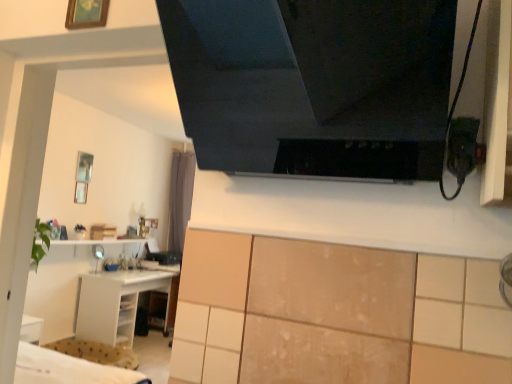
This screenshot has height=384, width=512. What do you see at coordinates (313, 83) in the screenshot?
I see `black glossy exhaust hood at upper center` at bounding box center [313, 83].

What do you see at coordinates (86, 14) in the screenshot? I see `wooden picture frame at upper left, acting as the 1th picture frame starting from the front` at bounding box center [86, 14].

Image resolution: width=512 pixels, height=384 pixels. I want to click on wooden picture frame at upper left, the 2th picture frame in the left-to-right sequence, so click(x=86, y=14).

Locate an element on the screen. This screenshot has width=512, height=384. metallic silver picture frame at upper left, positioned as the 2th picture frame in top-to-bottom order is located at coordinates click(x=81, y=192).

Describe the element at coordinates (180, 197) in the screenshot. The height and width of the screenshot is (384, 512). I see `gray fabric curtain at center` at that location.

The height and width of the screenshot is (384, 512). I want to click on black glossy exhaust hood at upper center, so click(x=313, y=83).

Is metallic silver picture frame at upper left, placed as the first picture frame when sorted from left to right, wider or thinner than black glossy exhaust hood at upper center?

Clearly, metallic silver picture frame at upper left, placed as the first picture frame when sorted from left to right, has less width compared to black glossy exhaust hood at upper center.

What's the angular difference between metallic silver picture frame at upper left, the 2th picture frame positioned from the right, and black glossy exhaust hood at upper center's facing directions?

89.5 degrees separate the facing orientations of metallic silver picture frame at upper left, the 2th picture frame positioned from the right, and black glossy exhaust hood at upper center.

Based on the photo, is metallic silver picture frame at upper left, the 2th picture frame positioned from the right, turned away from black glossy exhaust hood at upper center?

metallic silver picture frame at upper left, the 2th picture frame positioned from the right, is not turned away from black glossy exhaust hood at upper center.

Does black glossy exhaust hood at upper center touch white glossy shelf at lower left?

black glossy exhaust hood at upper center and white glossy shelf at lower left are not in contact.

Who is smaller, black glossy exhaust hood at upper center or white glossy shelf at lower left?

With smaller size is black glossy exhaust hood at upper center.

Which object is further away from the camera taking this photo, black glossy exhaust hood at upper center or white glossy shelf at lower left?

white glossy shelf at lower left is further from the camera.

What's the angular difference between black glossy exhaust hood at upper center and white glossy shelf at lower left's facing directions?

The facing directions of black glossy exhaust hood at upper center and white glossy shelf at lower left are 90.9 degrees apart.

What's the angular difference between wooden picture frame at upper left, acting as the 1th picture frame starting from the front, and gray fabric curtain at center's facing directions?

The facing directions of wooden picture frame at upper left, acting as the 1th picture frame starting from the front, and gray fabric curtain at center are 0.00233 degrees apart.

From the image's perspective, is wooden picture frame at upper left, the 1th picture frame viewed from the top, above gray fabric curtain at center?

Yes.

In terms of size, does wooden picture frame at upper left, which is the 1th picture frame in right-to-left order, appear bigger or smaller than gray fabric curtain at center?

In the image, wooden picture frame at upper left, which is the 1th picture frame in right-to-left order, appears to be smaller than gray fabric curtain at center.

Is wooden picture frame at upper left, which is the 1th picture frame in right-to-left order, wider than gray fabric curtain at center?

No, wooden picture frame at upper left, which is the 1th picture frame in right-to-left order, is not wider than gray fabric curtain at center.

Which object is closer to the camera, white glossy shelf at lower left or wooden picture frame at upper left, the 2th picture frame in the left-to-right sequence?

wooden picture frame at upper left, the 2th picture frame in the left-to-right sequence, is more forward.

Considering the sizes of objects white glossy shelf at lower left and wooden picture frame at upper left, the 2th picture frame in the left-to-right sequence, in the image provided, who is thinner, white glossy shelf at lower left or wooden picture frame at upper left, the 2th picture frame in the left-to-right sequence,?

wooden picture frame at upper left, the 2th picture frame in the left-to-right sequence, is thinner.

Between gray fabric curtain at center and black glossy exhaust hood at upper center, which one has larger width?

Wider between the two is black glossy exhaust hood at upper center.

Who is smaller, gray fabric curtain at center or black glossy exhaust hood at upper center?

black glossy exhaust hood at upper center.

What are the coordinates of `curtain below the black glossy exhaust hood at upper center (from the image's perspective)` in the screenshot? It's located at (180, 197).

How different are the orientations of metallic silver picture frame at upper left, which is counted as the 2th picture frame, starting from the front, and wooden picture frame at upper left, the 1th picture frame viewed from the top, in degrees?

The facing directions of metallic silver picture frame at upper left, which is counted as the 2th picture frame, starting from the front, and wooden picture frame at upper left, the 1th picture frame viewed from the top, are 89.3 degrees apart.

In the scene shown: Is wooden picture frame at upper left, acting as the 1th picture frame starting from the front, located within metallic silver picture frame at upper left, positioned as the 2th picture frame in top-to-bottom order?

That's incorrect, wooden picture frame at upper left, acting as the 1th picture frame starting from the front, is not inside metallic silver picture frame at upper left, positioned as the 2th picture frame in top-to-bottom order.

From the image's perspective, between metallic silver picture frame at upper left, positioned as the 2th picture frame in top-to-bottom order, and wooden picture frame at upper left, the 1th picture frame viewed from the top, who is located below?

metallic silver picture frame at upper left, positioned as the 2th picture frame in top-to-bottom order, is shown below in the image.

In terms of size, does metallic silver picture frame at upper left, positioned as the 2th picture frame in top-to-bottom order, appear bigger or smaller than wooden picture frame at upper left, which is the 1th picture frame in right-to-left order?

In the image, metallic silver picture frame at upper left, positioned as the 2th picture frame in top-to-bottom order, appears to be larger than wooden picture frame at upper left, which is the 1th picture frame in right-to-left order.

Is metallic silver picture frame at upper left, the 2th picture frame positioned from the right, wider or thinner than white glossy shelf at lower left?

Considering their sizes, metallic silver picture frame at upper left, the 2th picture frame positioned from the right, looks slimmer than white glossy shelf at lower left.

In order to click on shelf that is below the metallic silver picture frame at upper left, the 2th picture frame positioned from the right (from the image's perspective) in this screenshot , I will do `click(119, 303)`.

Considering the sizes of metallic silver picture frame at upper left, positioned as the 2th picture frame in top-to-bottom order, and white glossy shelf at lower left in the image, is metallic silver picture frame at upper left, positioned as the 2th picture frame in top-to-bottom order, taller or shorter than white glossy shelf at lower left?

In the image, metallic silver picture frame at upper left, positioned as the 2th picture frame in top-to-bottom order, appears to be shorter than white glossy shelf at lower left.

Does metallic silver picture frame at upper left, placed as the first picture frame when sorted from left to right, turn towards white glossy shelf at lower left?

No, metallic silver picture frame at upper left, placed as the first picture frame when sorted from left to right, is not facing towards white glossy shelf at lower left.

Identify the location of exhaust hood above the metallic silver picture frame at upper left, placed as the first picture frame when sorted from left to right (from the image's perspective). This screenshot has width=512, height=384. (313, 83).

Where is `shelf on the left of black glossy exhaust hood at upper center`? The height and width of the screenshot is (384, 512). shelf on the left of black glossy exhaust hood at upper center is located at coordinates (119, 303).

Which object lies nearer to the anchor point wooden picture frame at upper left, acting as the second picture frame starting from the bottom, white glossy shelf at lower left or black glossy exhaust hood at upper center?

black glossy exhaust hood at upper center is positioned closer to the anchor wooden picture frame at upper left, acting as the second picture frame starting from the bottom.

When comparing their distances from black glossy exhaust hood at upper center, does metallic silver picture frame at upper left, which is counted as the first picture frame, starting from the bottom, or white glossy shelf at lower left seem closer?

white glossy shelf at lower left lies closer to black glossy exhaust hood at upper center than the other object.

Estimate the real-world distances between objects in this image. Which object is closer to white glossy shelf at lower left, black glossy exhaust hood at upper center or gray fabric curtain at center?

The object closer to white glossy shelf at lower left is gray fabric curtain at center.

From the picture: Estimate the real-world distances between objects in this image. Which object is further from white glossy shelf at lower left, metallic silver picture frame at upper left, placed as the first picture frame when sorted from left to right, or black glossy exhaust hood at upper center?

The object further to white glossy shelf at lower left is black glossy exhaust hood at upper center.

When comparing their distances from wooden picture frame at upper left, the 2th picture frame in the left-to-right sequence, does white glossy shelf at lower left or gray fabric curtain at center seem further?

gray fabric curtain at center.

When comparing their distances from white glossy shelf at lower left, does gray fabric curtain at center or wooden picture frame at upper left, the 2th picture frame in the left-to-right sequence, seem further?

wooden picture frame at upper left, the 2th picture frame in the left-to-right sequence.

Based on their spatial positions, is white glossy shelf at lower left or black glossy exhaust hood at upper center closer to gray fabric curtain at center?

Based on the image, white glossy shelf at lower left appears to be nearer to gray fabric curtain at center.

When comparing their distances from metallic silver picture frame at upper left, placed as the first picture frame when sorted from left to right, does white glossy shelf at lower left or black glossy exhaust hood at upper center seem closer?

white glossy shelf at lower left is positioned closer to the anchor metallic silver picture frame at upper left, placed as the first picture frame when sorted from left to right.

Where is `shelf between wooden picture frame at upper left, acting as the second picture frame starting from the bottom, and metallic silver picture frame at upper left, placed as the first picture frame when sorted from back to front, in the front-back direction`? shelf between wooden picture frame at upper left, acting as the second picture frame starting from the bottom, and metallic silver picture frame at upper left, placed as the first picture frame when sorted from back to front, in the front-back direction is located at coordinates (119, 303).

Identify the location of picture frame located between white glossy shelf at lower left and gray fabric curtain at center in the depth direction. This screenshot has width=512, height=384. (81, 192).

The height and width of the screenshot is (384, 512). Identify the location of shelf located between black glossy exhaust hood at upper center and metallic silver picture frame at upper left, which is counted as the first picture frame, starting from the bottom, in the depth direction. (119, 303).

You are a GUI agent. You are given a task and a screenshot of the screen. Output one action in this format:
    pyautogui.click(x=<x>, y=<y>)
    Task: Click on the shelf between wooden picture frame at upper left, the 1th picture frame viewed from the top, and gray fabric curtain at center from front to back
    The height and width of the screenshot is (384, 512).
    Given the screenshot: What is the action you would take?
    pos(119,303)